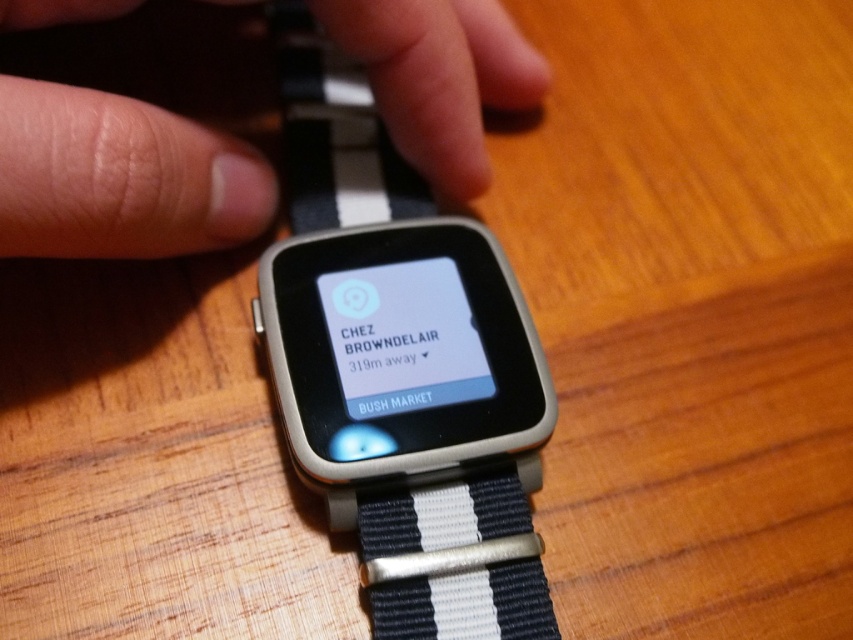
Question: Does black woven band at center have a larger size compared to black matte text at center?

Choices:
 (A) no
 (B) yes

Answer: (B)

Question: Which of the following is the closest to the observer?

Choices:
 (A) (395, 563)
 (B) (368, 358)
 (C) (196, 20)

Answer: (A)

Question: Estimate the real-world distances between objects in this image. Which object is farther from the black matte text at center?

Choices:
 (A) black woven band at center
 (B) white matte watch band at center

Answer: (B)

Question: Can you confirm if black woven band at center is bigger than white matte watch band at center?

Choices:
 (A) no
 (B) yes

Answer: (A)

Question: Does white matte watch band at center have a greater width compared to black matte text at center?

Choices:
 (A) yes
 (B) no

Answer: (A)

Question: Which object is positioned farthest from the black matte text at center?

Choices:
 (A) white matte watch band at center
 (B) black woven band at center

Answer: (A)